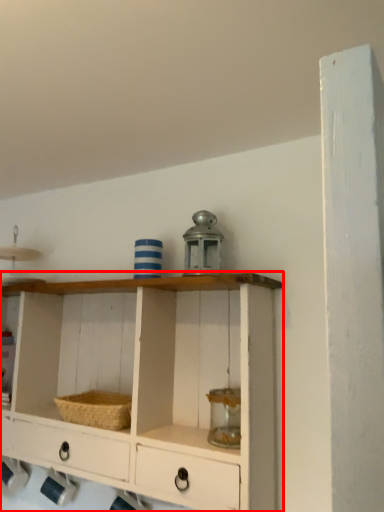
Question: In this image, where is shelf (annotated by the red box) located relative to basket?

Choices:
 (A) left
 (B) right

Answer: (A)